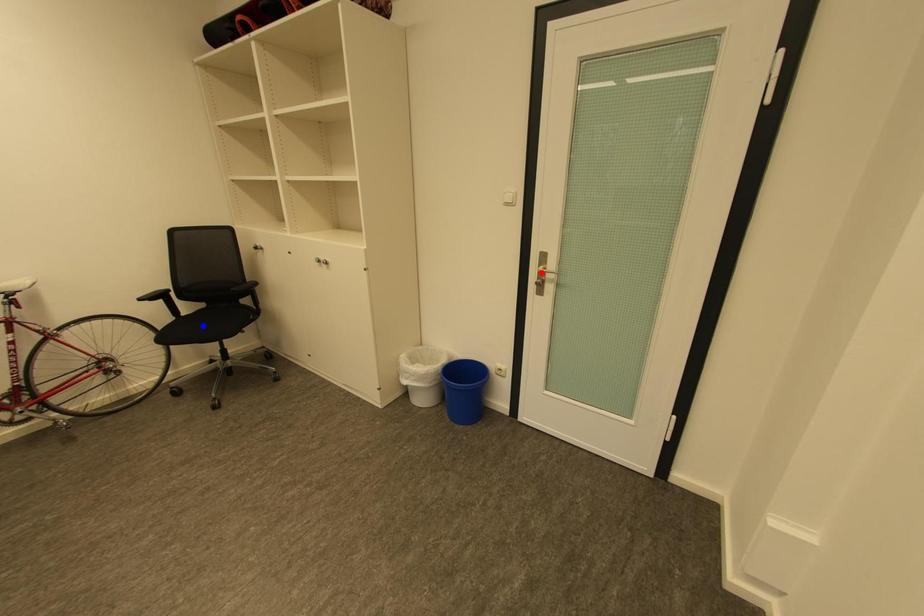
Question: In the image, two points are highlighted. Which point is nearer to the camera? Reply with the corresponding letter.

Choices:
 (A) blue point
 (B) red point

Answer: (B)